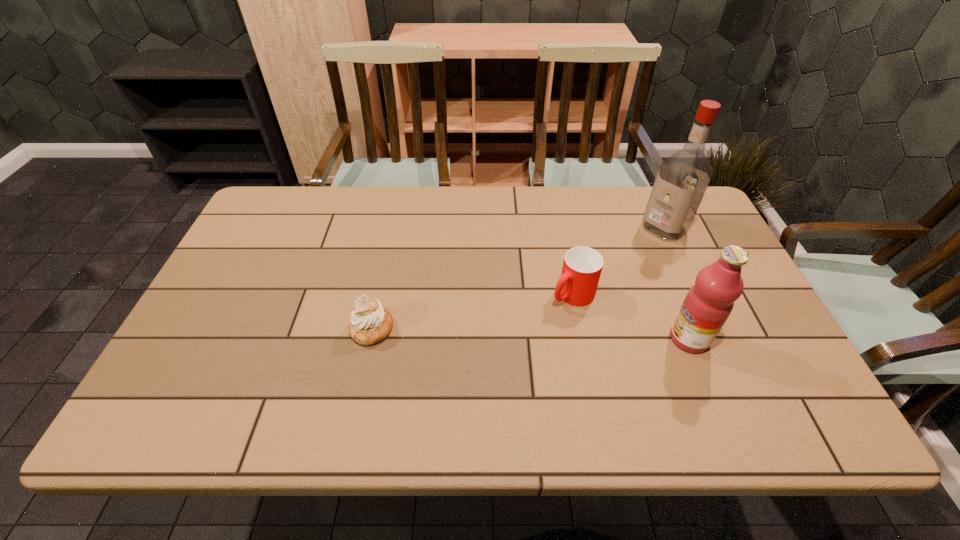
Find the location of a particular element. Image resolution: width=960 pixels, height=540 pixels. free spot between the pastry and the second shortest object is located at coordinates (472, 311).

At what (x,y) coordinates should I click in order to perform the action: click on free space between the tallest object and the leftmost object. Please return your answer as a coordinate pair (x, y). Looking at the image, I should click on (517, 278).

Where is `vacant area that lies between the tallest object and the second farthest object`? vacant area that lies between the tallest object and the second farthest object is located at coordinates (618, 261).

The image size is (960, 540). What are the coordinates of `free spot between the cup and the second tallest object` in the screenshot? It's located at (631, 316).

Find the location of a particular element. This screenshot has width=960, height=540. vacant region between the farthest object and the leftmost object is located at coordinates (517, 278).

Select which object appears as the closest to the third object from right to left. Please provide its 2D coordinates. Your answer should be formatted as a tuple, i.e. [(x, y)], where the tuple contains the x and y coordinates of a point satisfying the conditions above.

[(706, 307)]

Where is `the second closest object to the leftmost object`? The width and height of the screenshot is (960, 540). the second closest object to the leftmost object is located at coordinates (706, 307).

The height and width of the screenshot is (540, 960). I want to click on free spot that satisfies the following two spatial constraints: 1. on the back side of the shortest object; 2. on the right side of the farthest object, so click(393, 228).

The width and height of the screenshot is (960, 540). I want to click on vacant space that satisfies the following two spatial constraints: 1. on the back side of the second shortest object; 2. on the right side of the shortest object, so click(379, 294).

Where is `free region that satisfies the following two spatial constraints: 1. on the front side of the fruit juice; 2. on the label of the pastry`? Image resolution: width=960 pixels, height=540 pixels. free region that satisfies the following two spatial constraints: 1. on the front side of the fruit juice; 2. on the label of the pastry is located at coordinates pos(370,339).